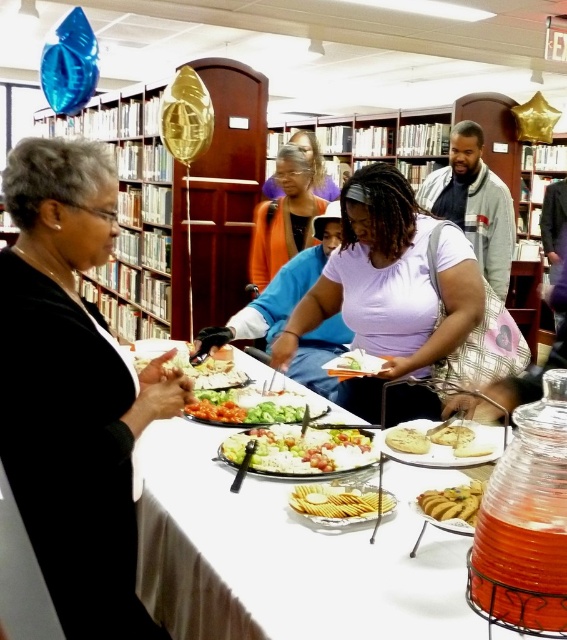
Question: Does white glossy salad at center have a lesser width compared to white crumbly bread at center?

Choices:
 (A) no
 (B) yes

Answer: (A)

Question: In this image, where is black matte sweater at left located relative to matte purple shirt at center?

Choices:
 (A) below
 (B) above

Answer: (A)

Question: Which point is farther to the camera?

Choices:
 (A) (325, 198)
 (B) (336, 486)
 (C) (294, 147)

Answer: (A)

Question: Which of the following is the closest to the observer?

Choices:
 (A) white glossy salad at center
 (B) purple matte shirt at center
 (C) vibrant green salad at center

Answer: (A)

Question: Is golden crisp crackers at center below white crumbly cake at center?

Choices:
 (A) no
 (B) yes

Answer: (B)

Question: Which object is farther from the camera taking this photo?

Choices:
 (A) vibrant green salad at center
 (B) white glossy salad at center
 (C) golden crisp crackers at center

Answer: (A)